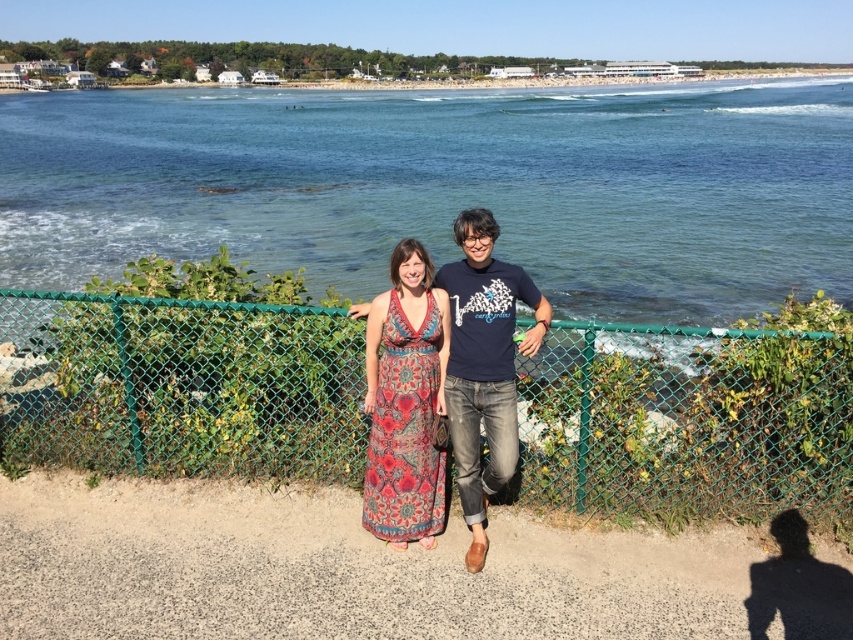
Is green chain-link fence at center smaller than patterned fabric dress at center?

Actually, green chain-link fence at center might be larger than patterned fabric dress at center.

Is the position of green chain-link fence at center more distant than that of patterned fabric dress at center?

Yes, green chain-link fence at center is further from the viewer.

Between point (688, 497) and point (469, 506), which one is positioned in front?

Point (469, 506)

Find the location of a particular element. The height and width of the screenshot is (640, 853). green chain-link fence at center is located at coordinates (181, 385).

Who is taller, smooth sand at lower center or printed fabric dress at center?

With more height is printed fabric dress at center.

Is point (495, 634) in front of point (425, 336)?

Yes.

Identify the location of smooth sand at lower center. (381, 570).

Is green chain-link fence at center shorter than smooth sand at lower center?

In fact, green chain-link fence at center may be taller than smooth sand at lower center.

Does green chain-link fence at center have a greater width compared to smooth sand at lower center?

No.

Which is in front, point (62, 388) or point (241, 592)?

Positioned in front is point (241, 592).

Identify the location of green chain-link fence at center. The width and height of the screenshot is (853, 640). (181, 385).